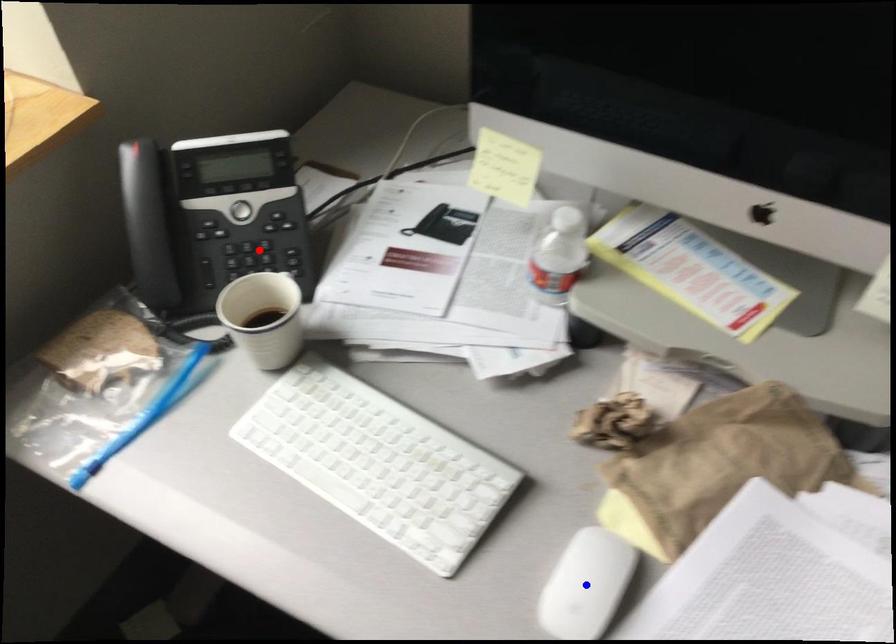
Question: In the image, two points are highlighted. Which point is nearer to the camera? Reply with the corresponding letter.

Choices:
 (A) blue point
 (B) red point

Answer: (A)